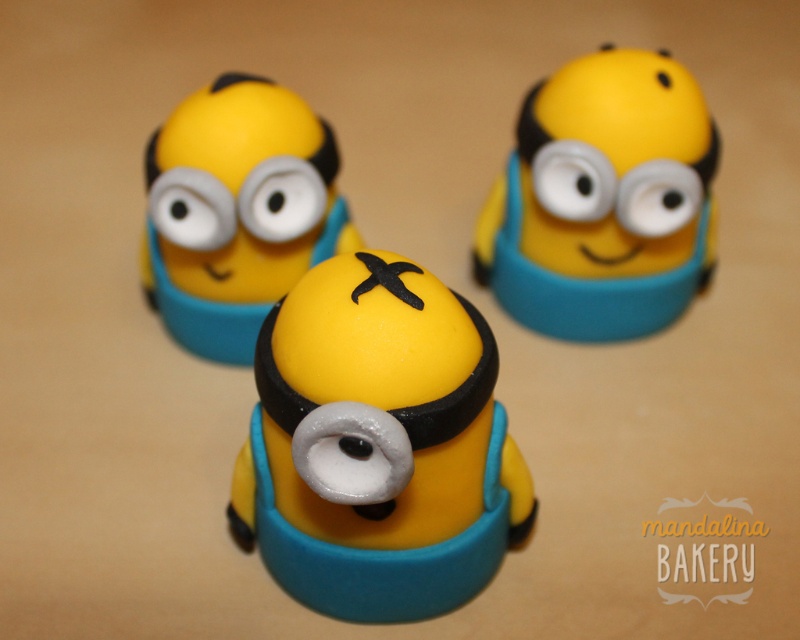
Can you confirm if yellow matte minion at upper right is positioned to the right of matte yellow fondant minion at center?

Correct, you'll find yellow matte minion at upper right to the right of matte yellow fondant minion at center.

Which is in front, point (588, 170) or point (280, 211)?

Positioned in front is point (280, 211).

Find the location of a particular element. The width and height of the screenshot is (800, 640). yellow matte minion at upper right is located at coordinates (602, 198).

Who is more forward, (416, 276) or (306, 225)?

Positioned in front is point (416, 276).

Identify the location of yellow matte minion at center. (378, 445).

Who is lower down, yellow matte minion at center or yellow matte minion at upper right?

yellow matte minion at center is below.

Between point (420, 397) and point (556, 321), which one is positioned behind?

The point (556, 321) is behind.

Locate an element on the screen. The width and height of the screenshot is (800, 640). yellow matte minion at center is located at coordinates (378, 445).